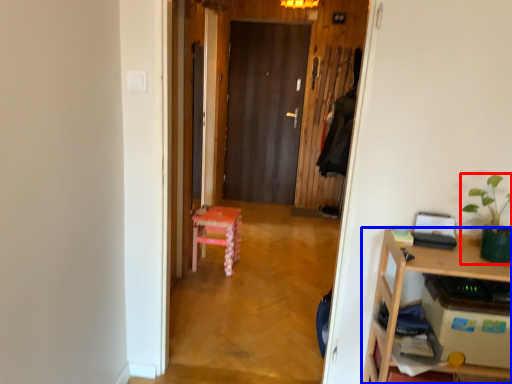
Question: Which point is closer to the camera, houseplant (highlighted by a red box) or desk (highlighted by a blue box)?

Choices:
 (A) houseplant
 (B) desk

Answer: (B)